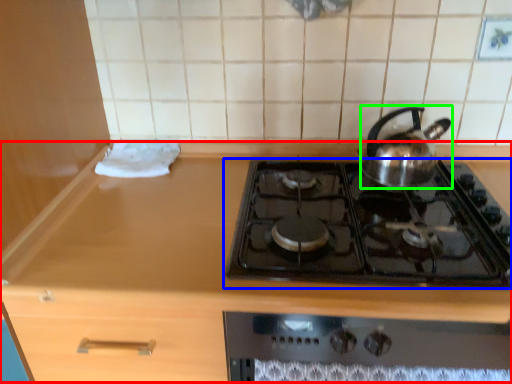
Question: Estimate the real-world distances between objects in this image. Which object is closer to counter (highlighted by a red box), gas stove (highlighted by a blue box) or kettle (highlighted by a green box)?

Choices:
 (A) gas stove
 (B) kettle

Answer: (A)